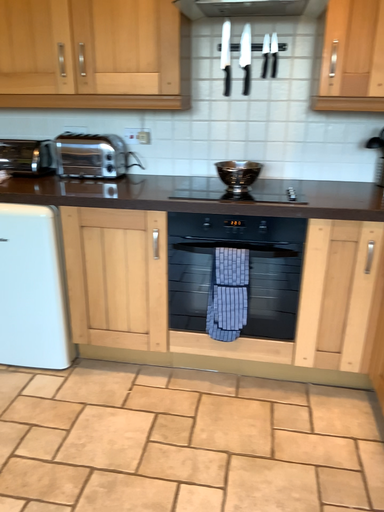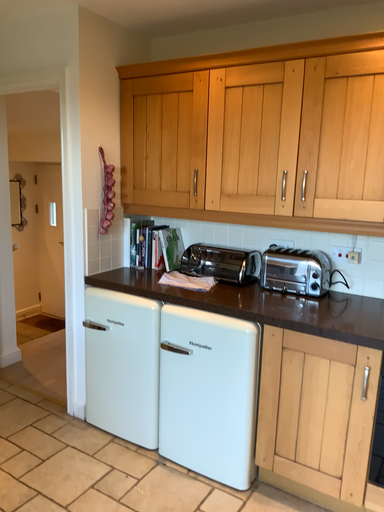
Question: Which way did the camera rotate in the video?

Choices:
 (A) rotated left
 (B) rotated right

Answer: (A)